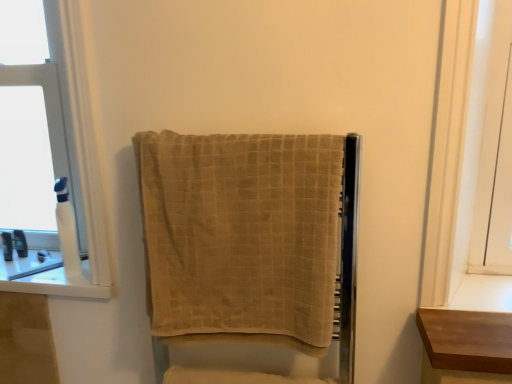
Find the location of a particular element. This screenshot has width=512, height=384. white plastic bottle at left, the 3th toiletry from the left is located at coordinates (67, 231).

In order to click on translucent plastic bottle at left, acting as the first toiletry starting from the back in this screenshot , I will do `click(20, 243)`.

Where is `beige textured towel at center`? The height and width of the screenshot is (384, 512). beige textured towel at center is located at coordinates (241, 236).

Is point (78, 42) behind point (7, 241)?

No, (78, 42) is closer to viewer.

From the image's perspective, who appears lower, white plastic bottle at left or translucent plastic bottle at left, the 1th toiletry positioned from the left?

From the image's view, translucent plastic bottle at left, the 1th toiletry positioned from the left, is below.

Which of these two, white plastic bottle at left or translucent plastic bottle at left, marked as the 3th toiletry in a right-to-left arrangement, is smaller?

translucent plastic bottle at left, marked as the 3th toiletry in a right-to-left arrangement.

From a real-world perspective, between translucent plastic bottle at left, marked as the 3th toiletry in a right-to-left arrangement, and beige textured towel at center, who is vertically lower?

In real-world perspective, translucent plastic bottle at left, marked as the 3th toiletry in a right-to-left arrangement, is lower.

Which is more to the right, translucent plastic bottle at left, the second toiletry from the back, or beige textured towel at center?

Positioned to the right is beige textured towel at center.

Looking at this image, considering the relative sizes of translucent plastic bottle at left, the second toiletry from the back, and beige textured towel at center in the image provided, is translucent plastic bottle at left, the second toiletry from the back, thinner than beige textured towel at center?

Yes, translucent plastic bottle at left, the second toiletry from the back, is thinner than beige textured towel at center.

Is translucent plastic bottle at left, the second toiletry viewed from the front, positioned beyond the bounds of beige textured towel at center?

Yes, translucent plastic bottle at left, the second toiletry viewed from the front, is not within beige textured towel at center.

In terms of width, does translucent plastic bottle at left, acting as the first toiletry starting from the back, look wider or thinner when compared to white plastic bottle at left, acting as the first toiletry starting from the right?

Considering their sizes, translucent plastic bottle at left, acting as the first toiletry starting from the back, looks slimmer than white plastic bottle at left, acting as the first toiletry starting from the right.

In the image, is translucent plastic bottle at left, acting as the first toiletry starting from the back, on the left side or the right side of white plastic bottle at left, acting as the third toiletry starting from the back?

In the image, translucent plastic bottle at left, acting as the first toiletry starting from the back, appears on the left side of white plastic bottle at left, acting as the third toiletry starting from the back.

Considering the positions of objects translucent plastic bottle at left, acting as the first toiletry starting from the back, and white plastic bottle at left, the 3th toiletry from the left, in the image provided, who is behind, translucent plastic bottle at left, acting as the first toiletry starting from the back, or white plastic bottle at left, the 3th toiletry from the left,?

translucent plastic bottle at left, acting as the first toiletry starting from the back, is more distant.

You are a GUI agent. You are given a task and a screenshot of the screen. Output one action in this format:
    pyautogui.click(x=<x>, y=<y>)
    Task: Click on the furniture in front of the white plastic bottle at left
    
    Given the screenshot: What is the action you would take?
    pyautogui.click(x=465, y=346)

Between light brown wood shelf at right and white plastic bottle at left, which one has more height?

Standing taller between the two is white plastic bottle at left.

Considering the relative sizes of light brown wood shelf at right and white plastic bottle at left in the image provided, is light brown wood shelf at right thinner than white plastic bottle at left?

Incorrect, the width of light brown wood shelf at right is not less than that of white plastic bottle at left.

Does point (24, 269) come behind point (24, 239)?

That is False.

Who is taller, white glossy window sill at left or translucent plastic bottle at left, the second toiletry positioned from the right?

Standing taller between the two is translucent plastic bottle at left, the second toiletry positioned from the right.

Which is more to the right, white glossy window sill at left or translucent plastic bottle at left, acting as the first toiletry starting from the back?

From the viewer's perspective, white glossy window sill at left appears more on the right side.

From the picture: Is there a large distance between white glossy window sill at left and translucent plastic bottle at left, acting as the first toiletry starting from the back?

No, white glossy window sill at left is in close proximity to translucent plastic bottle at left, acting as the first toiletry starting from the back.

Does white glossy window sill at left have a lesser height compared to white plastic bottle at left, the 3th toiletry from the left?

Yes, white glossy window sill at left is shorter than white plastic bottle at left, the 3th toiletry from the left.

Are white glossy window sill at left and white plastic bottle at left, the first toiletry from the front, beside each other?

No, white glossy window sill at left is not touching white plastic bottle at left, the first toiletry from the front.

From the image's perspective, is white glossy window sill at left located above or below white plastic bottle at left, acting as the first toiletry starting from the right?

white glossy window sill at left is situated lower than white plastic bottle at left, acting as the first toiletry starting from the right, in the image.

Can you tell me how much white glossy window sill at left and white plastic bottle at left, the first toiletry from the front, differ in facing direction?

There is a 27.4-degree angle between the facing directions of white glossy window sill at left and white plastic bottle at left, the first toiletry from the front.

Based on the photo, from the image's perspective, which is below, translucent plastic bottle at left, the second toiletry viewed from the front, or translucent plastic bottle at left, acting as the first toiletry starting from the back?

From the image's view, translucent plastic bottle at left, the second toiletry viewed from the front, is below.

Is translucent plastic bottle at left, the second toiletry from the back, positioned beyond the bounds of translucent plastic bottle at left, the 2th toiletry positioned from the left?

Yes, translucent plastic bottle at left, the second toiletry from the back, is located beyond the bounds of translucent plastic bottle at left, the 2th toiletry positioned from the left.

How many degrees apart are the facing directions of translucent plastic bottle at left, marked as the 3th toiletry in a right-to-left arrangement, and translucent plastic bottle at left, acting as the first toiletry starting from the back?

0.0042 degrees separate the facing orientations of translucent plastic bottle at left, marked as the 3th toiletry in a right-to-left arrangement, and translucent plastic bottle at left, acting as the first toiletry starting from the back.

Considering the positions of objects translucent plastic bottle at left, the 1th toiletry positioned from the left, and translucent plastic bottle at left, which ranks as the 3th toiletry in front-to-back order, in the image provided, who is in front, translucent plastic bottle at left, the 1th toiletry positioned from the left, or translucent plastic bottle at left, which ranks as the 3th toiletry in front-to-back order,?

translucent plastic bottle at left, the 1th toiletry positioned from the left, is closer to the camera.

Find the location of a particular element. The image size is (512, 384). window in front of the translucent plastic bottle at left, the second toiletry viewed from the front is located at coordinates (68, 162).

This screenshot has width=512, height=384. Identify the location of the 3rd toiletry counting from the left side of the beige textured towel at center. (7, 246).

When comparing their distances from beige textured towel at center, does translucent plastic bottle at left, the second toiletry positioned from the right, or light brown wood shelf at right seem further?

Among the two, translucent plastic bottle at left, the second toiletry positioned from the right, is located further to beige textured towel at center.

Estimate the real-world distances between objects in this image. Which object is further from white plastic bottle at left, the 3th toiletry from the left, light brown wood shelf at right or white glossy window sill at left?

Among the two, light brown wood shelf at right is located further to white plastic bottle at left, the 3th toiletry from the left.

Looking at the image, which one is located further to translucent plastic bottle at left, acting as the first toiletry starting from the back, white glossy window sill at left or white plastic bottle at left?

Based on the image, white plastic bottle at left appears to be further to translucent plastic bottle at left, acting as the first toiletry starting from the back.

Which object lies nearer to the anchor point white glossy window sill at left, light brown wood shelf at right or white plastic bottle at left, acting as the first toiletry starting from the right?

white plastic bottle at left, acting as the first toiletry starting from the right, is positioned closer to the anchor white glossy window sill at left.

Looking at the image, which one is located closer to translucent plastic bottle at left, marked as the 3th toiletry in a right-to-left arrangement, white plastic bottle at left, the first toiletry from the front, or white plastic bottle at left?

The object closer to translucent plastic bottle at left, marked as the 3th toiletry in a right-to-left arrangement, is white plastic bottle at left, the first toiletry from the front.

From the image, which object appears to be nearer to beige textured towel at center, light brown wood shelf at right or white glossy window sill at left?

light brown wood shelf at right is closer to beige textured towel at center.

Looking at the image, which one is located further to white plastic bottle at left, the first toiletry from the front, white plastic bottle at left or translucent plastic bottle at left, the second toiletry viewed from the front?

Among the two, translucent plastic bottle at left, the second toiletry viewed from the front, is located further to white plastic bottle at left, the first toiletry from the front.

Based on their spatial positions, is translucent plastic bottle at left, the second toiletry from the back, or white glossy window sill at left further from white plastic bottle at left, the first toiletry from the front?

translucent plastic bottle at left, the second toiletry from the back.

This screenshot has height=384, width=512. Identify the location of window sill situated between white plastic bottle at left and light brown wood shelf at right from left to right. pos(49,279).

Locate an element on the screen. towel located between white glossy window sill at left and light brown wood shelf at right in the left-right direction is located at coordinates click(x=241, y=236).

Locate an element on the screen. This screenshot has height=384, width=512. toiletry between white plastic bottle at left and light brown wood shelf at right in the horizontal direction is located at coordinates 67,231.

Find the location of a particular element. This screenshot has height=384, width=512. toiletry situated between translucent plastic bottle at left, acting as the first toiletry starting from the back, and beige textured towel at center from left to right is located at coordinates (67, 231).